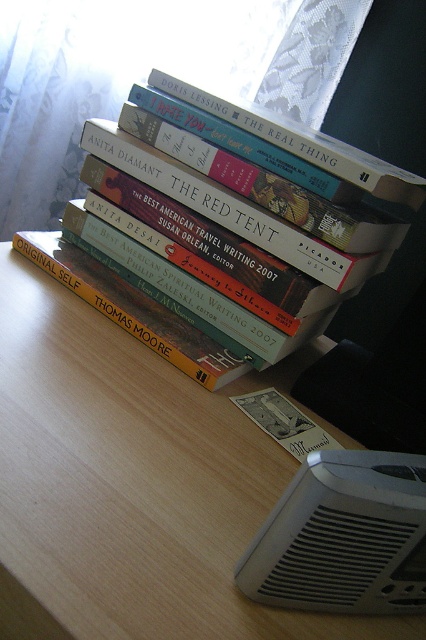
Between point (16, 408) and point (166, 326), which one is positioned in front?

Point (16, 408)

Measure the distance between wooden table at center and camera.

A distance of 32.76 centimeters exists between wooden table at center and camera.

Where is `wooden table at center`? This screenshot has height=640, width=426. wooden table at center is located at coordinates (134, 483).

Who is higher up, hardcover book at center or yellow matte book at center?

hardcover book at center is higher up.

Identify the location of hardcover book at center. This screenshot has width=426, height=640. (216, 234).

This screenshot has height=640, width=426. I want to click on hardcover book at center, so click(216, 234).

Who is shorter, wooden table at center or hardcover book at center?

wooden table at center

From the picture: Can you confirm if wooden table at center is bigger than hardcover book at center?

Yes.

Which is behind, point (19, 429) or point (229, 156)?

The point (229, 156) is behind.

At what (x,y) coordinates should I click in order to perform the action: click on wooden table at center. Please return your answer as a coordinate pair (x, y). The width and height of the screenshot is (426, 640). Looking at the image, I should click on (134, 483).